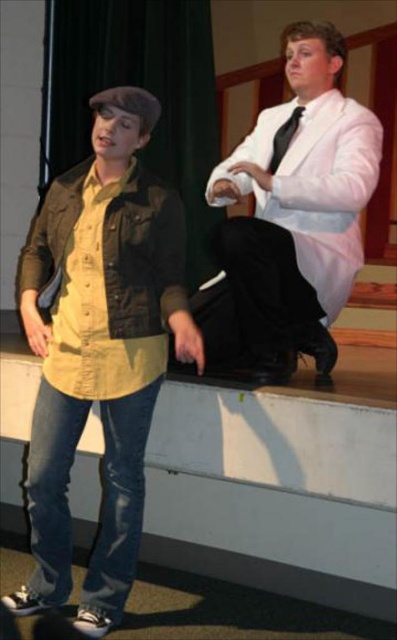
Question: Among these objects, which one is farthest from the camera?

Choices:
 (A) white satin suit at upper right
 (B) smooth concrete ledge at lower center
 (C) black satin tie at upper right

Answer: (B)

Question: Which point is closer to the camera taking this photo?

Choices:
 (A) (x=285, y=68)
 (B) (x=393, y=474)
 (C) (x=19, y=284)

Answer: (B)

Question: Is matte khaki lab coat at left positioned at the back of black satin tie at upper right?

Choices:
 (A) no
 (B) yes

Answer: (A)

Question: Is matte brown leather jacket at left thinner than matte khaki lab coat at left?

Choices:
 (A) yes
 (B) no

Answer: (B)

Question: Can you confirm if matte khaki lab coat at left is positioned to the left of black satin tie at upper right?

Choices:
 (A) no
 (B) yes

Answer: (B)

Question: Which point is closer to the camera taking this photo?

Choices:
 (A) (310, 212)
 (B) (98, 282)
 (C) (115, 337)

Answer: (B)